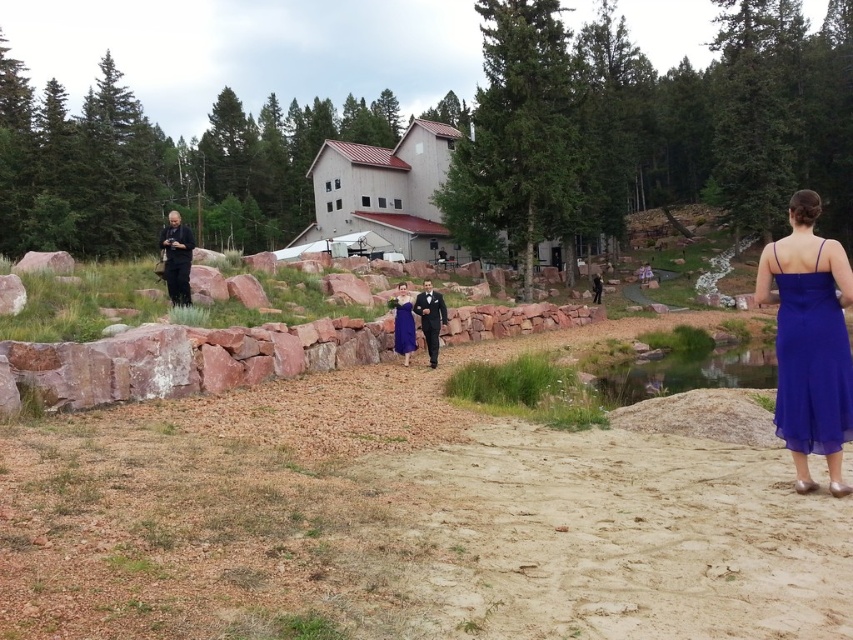
You are a photographer positioned at the starting point of the path. You see the shiny black suit at center and the royal blue chiffon dress at center. Which one is positioned to the right from your perspective?

The shiny black suit at center is positioned to the right of the royal blue chiffon dress at center from your perspective.

You are a photographer positioned at the back of the sandy area. You want to take a photo of the royal blue chiffon dress at center and the clear water at center so that both are visible. Based on their positions, which object should be closer to the camera?

The clear water at center is in front of the royal blue chiffon dress at center, so the clear water at center is closer to the camera.

You are standing at the camera position and want to place a small bouquet of flowers between the two points, point 1 at coordinates point (183, 248) and point 2 at coordinates point (401, 352). Which point is closer to you so you can place the bouquet there?

Point (183, 248) is closer to the camera than point (401, 352), so you should place the bouquet there.